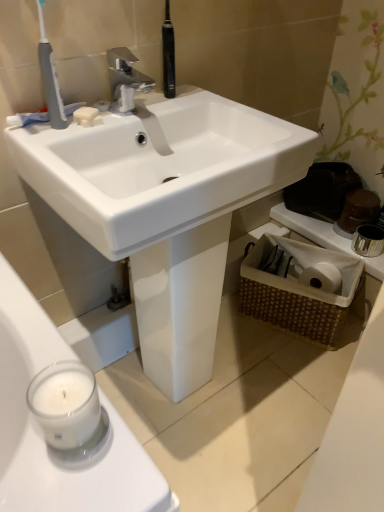
Identify the location of free area behind silver metallic faucet at upper center. The width and height of the screenshot is (384, 512). (160, 98).